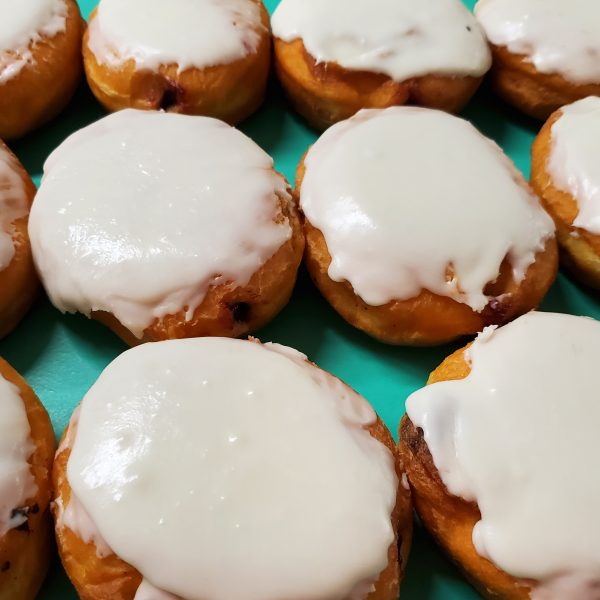
Locate an element on the screen. The height and width of the screenshot is (600, 600). wrinkle in table cloth is located at coordinates (569, 287).